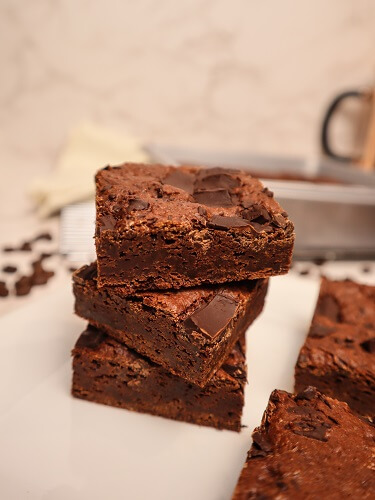
The width and height of the screenshot is (375, 500). What are the coordinates of `counter` in the screenshot? It's located at (154, 457).